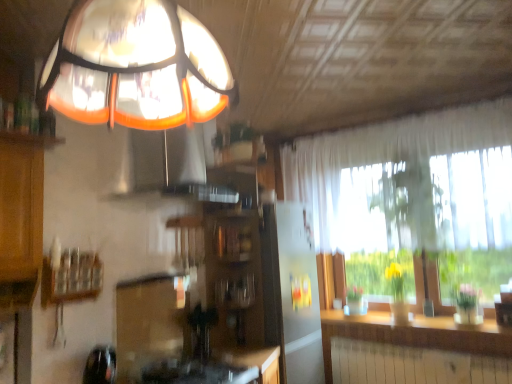
Question: Can you confirm if translucent glass lampshade at upper center is taller than orange glass exhaust hood at upper center?

Choices:
 (A) yes
 (B) no

Answer: (B)

Question: Does translucent glass lampshade at upper center lie behind orange glass exhaust hood at upper center?

Choices:
 (A) yes
 (B) no

Answer: (B)

Question: Can you confirm if translucent glass lampshade at upper center is shorter than orange glass exhaust hood at upper center?

Choices:
 (A) no
 (B) yes

Answer: (B)

Question: Would you say translucent glass lampshade at upper center is outside orange glass exhaust hood at upper center?

Choices:
 (A) yes
 (B) no

Answer: (A)

Question: Can you confirm if translucent glass lampshade at upper center is thinner than orange glass exhaust hood at upper center?

Choices:
 (A) no
 (B) yes

Answer: (A)

Question: From the image's perspective, is orange glass exhaust hood at upper center above or below wooden counter top at lower right?

Choices:
 (A) below
 (B) above

Answer: (B)

Question: In the image, is orange glass exhaust hood at upper center on the left side or the right side of wooden counter top at lower right?

Choices:
 (A) right
 (B) left

Answer: (B)

Question: From a real-world perspective, is orange glass exhaust hood at upper center above or below wooden counter top at lower right?

Choices:
 (A) above
 (B) below

Answer: (A)

Question: Based on their sizes in the image, would you say orange glass exhaust hood at upper center is bigger or smaller than wooden counter top at lower right?

Choices:
 (A) small
 (B) big

Answer: (B)

Question: Is wooden shelf at left in front of or behind translucent glass lampshade at upper center in the image?

Choices:
 (A) behind
 (B) front

Answer: (A)

Question: Considering the positions of point (71, 256) and point (47, 61), is point (71, 256) closer or farther from the camera than point (47, 61)?

Choices:
 (A) closer
 (B) farther

Answer: (B)

Question: Considering the positions of wooden shelf at left and translucent glass lampshade at upper center in the image, is wooden shelf at left taller or shorter than translucent glass lampshade at upper center?

Choices:
 (A) tall
 (B) short

Answer: (B)

Question: Considering the positions of wooden shelf at left and translucent glass lampshade at upper center in the image, is wooden shelf at left bigger or smaller than translucent glass lampshade at upper center?

Choices:
 (A) big
 (B) small

Answer: (B)

Question: Is translucent glass lampshade at upper center taller or shorter than orange glass exhaust hood at upper center?

Choices:
 (A) tall
 (B) short

Answer: (B)

Question: From the image's perspective, is translucent glass lampshade at upper center located above or below orange glass exhaust hood at upper center?

Choices:
 (A) above
 (B) below

Answer: (A)